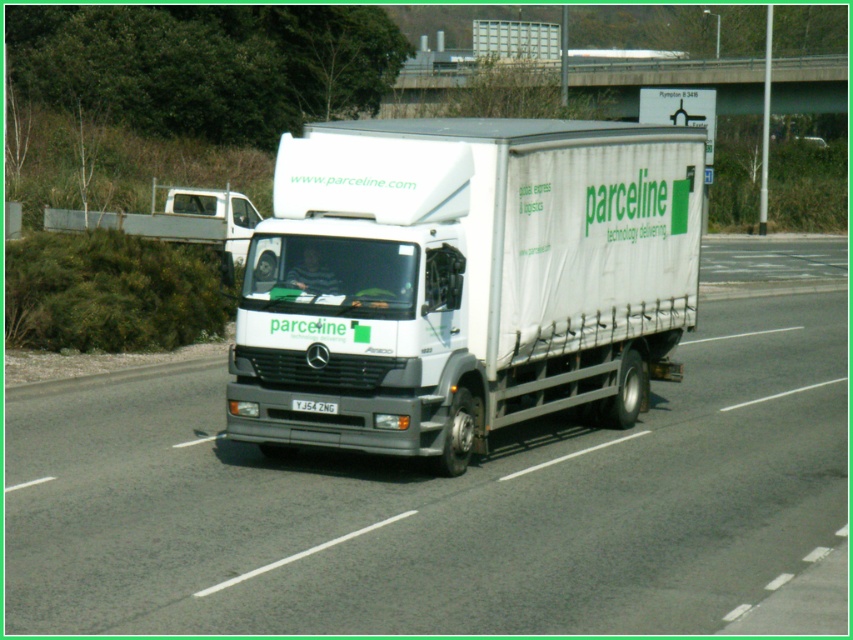
Question: In this image, where is white glossy truck at center located relative to white plastic license plate at center?

Choices:
 (A) above
 (B) below

Answer: (A)

Question: Among these points, which one is farthest from the camera?

Choices:
 (A) (791, 364)
 (B) (639, 282)
 (C) (312, 412)

Answer: (A)

Question: Which object is farther from the camera taking this photo?

Choices:
 (A) white matte truck at center
 (B) white plastic license plate at center

Answer: (A)

Question: From the image, what is the correct spatial relationship of white glossy truck at center in relation to white plastic license plate at center?

Choices:
 (A) above
 (B) below

Answer: (A)

Question: Which of the following is the closest to the observer?

Choices:
 (A) white matte truck at center
 (B) white plastic license plate at center
 (C) white glossy truck at center

Answer: (C)

Question: Does white glossy truck at center come in front of white matte truck at center?

Choices:
 (A) no
 (B) yes

Answer: (B)